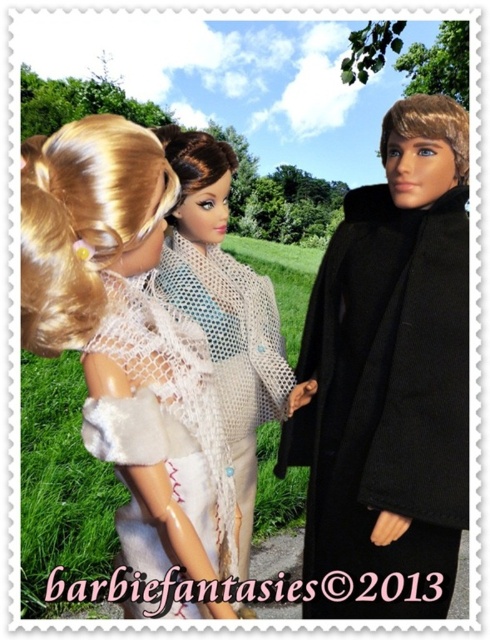
You are a child trying to decide which coat to wear for a walk in the park. You see the black wool coat at right and the white fuzzy coat at upper left in the image. Which coat is positioned lower in the image?

The black wool coat at right is positioned below the white fuzzy coat at upper left, so it is lower in the image.

You are a photographer setting up a tripod to take a photo of the white fuzzy coat at upper left and the white lace scarf at center. Which object should you focus on first to ensure both are in sharp focus?

You should focus on the white fuzzy coat at upper left first because it is closer to the viewer than the white lace scarf at center, so adjusting focus from near to far will help both objects be in sharp focus.